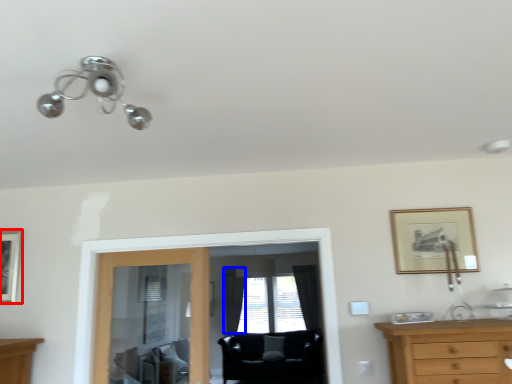
Question: Among these objects, which one is farthest to the camera, picture frame (highlighted by a red box) or curtain (highlighted by a blue box)?

Choices:
 (A) picture frame
 (B) curtain

Answer: (B)